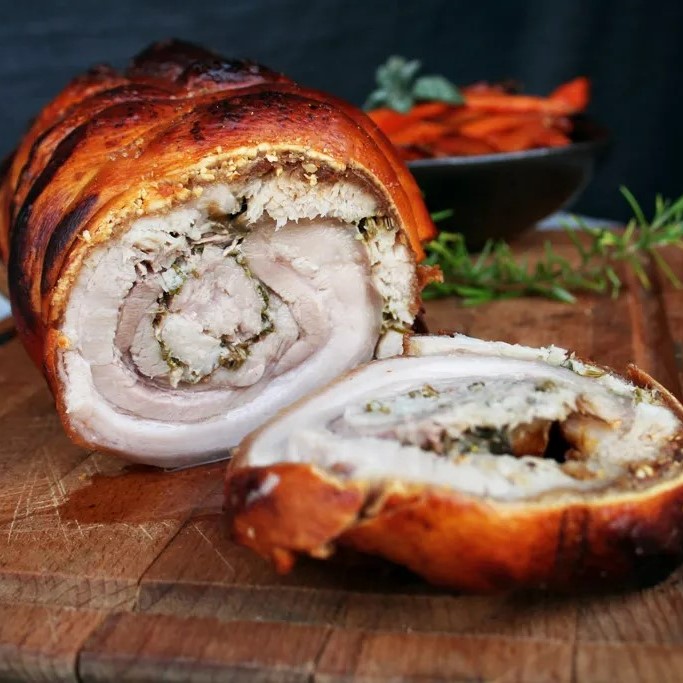
The width and height of the screenshot is (683, 683). Find the location of `white tabletop`. white tabletop is located at coordinates (561, 218), (5, 306).